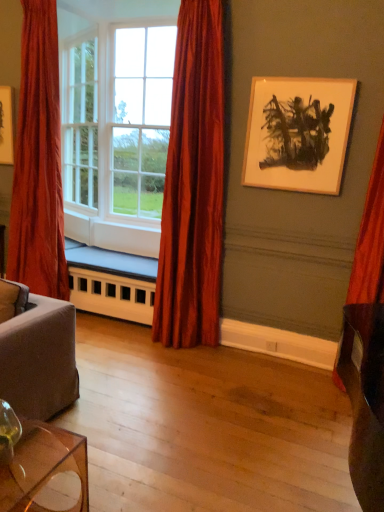
This screenshot has width=384, height=512. In order to click on white painted wood radiator at lower center in this screenshot , I will do `click(112, 295)`.

The height and width of the screenshot is (512, 384). I want to click on velvet red curtain at right, acting as the 3th curtain starting from the left, so 370,234.

Image resolution: width=384 pixels, height=512 pixels. I want to click on white painted wood radiator at lower center, so click(x=112, y=295).

Would you say transparent glass table at lower left is part of velvet red curtain at right, placed as the first curtain when sorted from right to left,'s contents?

Definitely not — transparent glass table at lower left is not inside velvet red curtain at right, placed as the first curtain when sorted from right to left.

From a real-world perspective, is velvet red curtain at right, placed as the first curtain when sorted from right to left, located higher than transparent glass table at lower left?

Correct, in the physical world, velvet red curtain at right, placed as the first curtain when sorted from right to left, is higher than transparent glass table at lower left.

Is velvet red curtain at right, acting as the 3th curtain starting from the left, turned away from transparent glass table at lower left?

velvet red curtain at right, acting as the 3th curtain starting from the left, does not have its back to transparent glass table at lower left.

Is velvet red curtain at right, placed as the first curtain when sorted from right to left, bigger than transparent glass table at lower left?

Yes.

Based on the photo, does velvet red curtain at right, acting as the 3th curtain starting from the left, have a larger size compared to wooden picture frame at upper right?

Yes.

Is velvet red curtain at right, acting as the 3th curtain starting from the left, positioned before wooden picture frame at upper right?

Yes, it is in front of wooden picture frame at upper right.

Consider the image. Is velvet red curtain at right, placed as the first curtain when sorted from right to left, at the right side of wooden picture frame at upper right?

Indeed, velvet red curtain at right, placed as the first curtain when sorted from right to left, is positioned on the right side of wooden picture frame at upper right.

Measure the distance from velvet red curtain at right, acting as the 3th curtain starting from the left, to wooden picture frame at upper right.

They are 21.08 inches apart.

From the image's perspective, which one is positioned lower, white painted wood radiator at lower center or velvet red curtain at right, acting as the 3th curtain starting from the left?

white painted wood radiator at lower center appears lower in the image.

Starting from the white painted wood radiator at lower center, which curtain is the 3rd one in front? Please provide its 2D coordinates.

[(370, 234)]

Can you confirm if white painted wood radiator at lower center is wider than velvet red curtain at right, placed as the first curtain when sorted from right to left?

Correct, the width of white painted wood radiator at lower center exceeds that of velvet red curtain at right, placed as the first curtain when sorted from right to left.

From the image's perspective, which one is positioned lower, velvet red curtain at right, acting as the 3th curtain starting from the left, or white glass window at center?

From the image's view, velvet red curtain at right, acting as the 3th curtain starting from the left, is below.

Where is `window behind the velvet red curtain at right, acting as the 3th curtain starting from the left`? window behind the velvet red curtain at right, acting as the 3th curtain starting from the left is located at coordinates (117, 120).

Based on the photo, is white glass window at center surrounded by velvet red curtain at right, placed as the first curtain when sorted from right to left?

No, white glass window at center is not surrounded by velvet red curtain at right, placed as the first curtain when sorted from right to left.

Locate an element on the screen. curtain that is the 1st one when counting rightward from the white glass window at center is located at coordinates (193, 185).

Does white glass window at center come behind silky red curtain at center, which appears as the 2th curtain when viewed from the right?

Yes, white glass window at center is further from the viewer.

Looking at the image, does white glass window at center seem bigger or smaller compared to silky red curtain at center, which ranks as the 2th curtain in left-to-right order?

Considering their sizes, white glass window at center takes up more space than silky red curtain at center, which ranks as the 2th curtain in left-to-right order.

Would you say white glass window at center is inside or outside silky red curtain at center, which appears as the 2th curtain when viewed from the right?

white glass window at center cannot be found inside silky red curtain at center, which appears as the 2th curtain when viewed from the right.

Looking at this image, is transparent glass table at lower left aimed at white painted wood radiator at lower center?

No.

Looking at this image, can you tell me how much transparent glass table at lower left and white painted wood radiator at lower center differ in facing direction?

The angular difference between transparent glass table at lower left and white painted wood radiator at lower center is 90.3 degrees.

Is transparent glass table at lower left not near white painted wood radiator at lower center?

Indeed, transparent glass table at lower left is not near white painted wood radiator at lower center.

Can you confirm if transparent glass table at lower left is positioned to the right of white painted wood radiator at lower center?

Indeed, transparent glass table at lower left is positioned on the right side of white painted wood radiator at lower center.

Image resolution: width=384 pixels, height=512 pixels. I want to click on picture frame that is above the silky red curtain at center, which appears as the 2th curtain when viewed from the right (from the image's perspective), so click(x=298, y=134).

Considering the relative sizes of wooden picture frame at upper right and silky red curtain at center, which ranks as the 2th curtain in left-to-right order, in the image provided, is wooden picture frame at upper right taller than silky red curtain at center, which ranks as the 2th curtain in left-to-right order,?

Incorrect, the height of wooden picture frame at upper right is not larger of that of silky red curtain at center, which ranks as the 2th curtain in left-to-right order.

Is wooden picture frame at upper right not within silky red curtain at center, which appears as the 2th curtain when viewed from the right?

Yes, wooden picture frame at upper right is outside of silky red curtain at center, which appears as the 2th curtain when viewed from the right.

Find the location of `the 2nd curtain counting from the right of the transparent glass table at lower left`. the 2nd curtain counting from the right of the transparent glass table at lower left is located at coordinates (370, 234).

Locate an element on the screen. picture frame behind the velvet red curtain at right, placed as the first curtain when sorted from right to left is located at coordinates (298, 134).

Which object lies further to the anchor point velvet red curtain at right, acting as the 3th curtain starting from the left, white painted wood radiator at lower center or transparent glass table at lower left?

Among the two, transparent glass table at lower left is located further to velvet red curtain at right, acting as the 3th curtain starting from the left.

Which object lies nearer to the anchor point white glass window at center, white painted wood radiator at lower center or velvet red curtain at right, acting as the 3th curtain starting from the left?

white painted wood radiator at lower center.

Which object lies further to the anchor point velvet red curtain at right, acting as the 3th curtain starting from the left, transparent glass table at lower left or silky red curtain at center, which appears as the 2th curtain when viewed from the right?

Based on the image, transparent glass table at lower left appears to be further to velvet red curtain at right, acting as the 3th curtain starting from the left.

From the picture: Estimate the real-world distances between objects in this image. Which object is further from velvet red curtain at left, placed as the third curtain when sorted from right to left, transparent glass table at lower left or white glass window at center?

transparent glass table at lower left is further to velvet red curtain at left, placed as the third curtain when sorted from right to left.

From the image, which object appears to be nearer to velvet red curtain at right, acting as the 3th curtain starting from the left, silky red curtain at center, which ranks as the 2th curtain in left-to-right order, or white glass window at center?

silky red curtain at center, which ranks as the 2th curtain in left-to-right order, lies closer to velvet red curtain at right, acting as the 3th curtain starting from the left, than the other object.

Based on their spatial positions, is transparent glass table at lower left or velvet red curtain at left, placed as the third curtain when sorted from right to left, closer to white glass window at center?

Based on the image, velvet red curtain at left, placed as the third curtain when sorted from right to left, appears to be nearer to white glass window at center.

Considering their positions, is white glass window at center positioned closer to white painted wood radiator at lower center than transparent glass table at lower left?

white glass window at center is positioned closer to the anchor white painted wood radiator at lower center.

Looking at the image, which one is located further to velvet red curtain at left, placed as the third curtain when sorted from right to left, velvet red curtain at right, acting as the 3th curtain starting from the left, or silky red curtain at center, which ranks as the 2th curtain in left-to-right order?

velvet red curtain at right, acting as the 3th curtain starting from the left, is further to velvet red curtain at left, placed as the third curtain when sorted from right to left.

I want to click on picture frame situated between white painted wood radiator at lower center and velvet red curtain at right, acting as the 3th curtain starting from the left, from left to right, so click(298, 134).

Identify the location of picture frame between transparent glass table at lower left and velvet red curtain at right, acting as the 3th curtain starting from the left. (298, 134).

Identify the location of table between velvet red curtain at left, the 1th curtain positioned from the left, and velvet red curtain at right, placed as the first curtain when sorted from right to left. The image size is (384, 512). (46, 471).

The image size is (384, 512). In order to click on window positioned between transparent glass table at lower left and white painted wood radiator at lower center from near to far in this screenshot , I will do `click(117, 120)`.